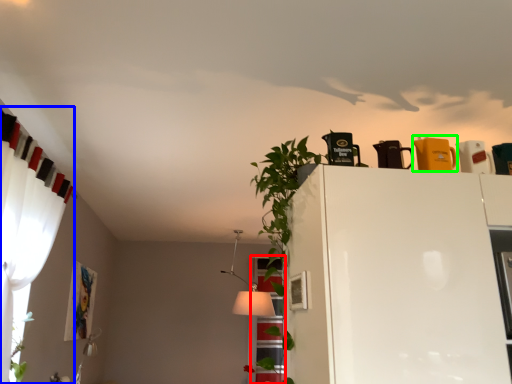
Question: Which is nearer to the window (highlighted by a red box)? curtain (highlighted by a blue box) or appliance (highlighted by a green box).

Choices:
 (A) curtain
 (B) appliance

Answer: (A)